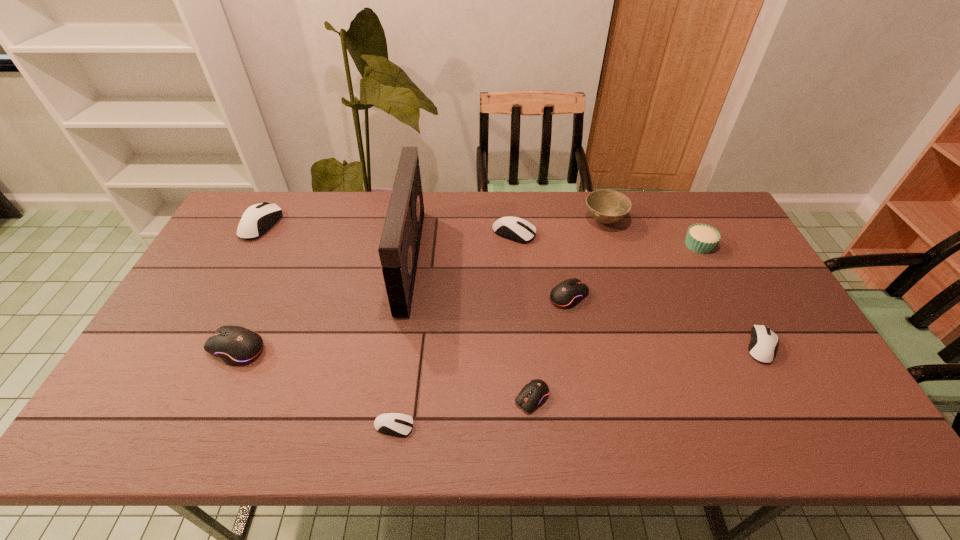
At what (x,y) coordinates should I click in order to perform the action: click on vacant space located on the front of the leftmost black computer mouse. Please return your answer as a coordinate pair (x, y). Looking at the image, I should click on (199, 431).

This screenshot has width=960, height=540. I want to click on free spot located on the left of the cupcake, so click(588, 245).

Identify the location of vacant space situated 0.220m on the right of the third smallest white mouse. (601, 233).

At what (x,y) coordinates should I click in order to perform the action: click on free location located 0.320m on the front of the second mouse from right to left. Please return your answer as a coordinate pair (x, y). The width and height of the screenshot is (960, 540). Looking at the image, I should click on (591, 416).

I want to click on vacant space located on the left of the rightmost mouse, so click(x=637, y=346).

At what (x,y) coordinates should I click in order to perform the action: click on blank space located on the back of the ninth farthest object. Please return your answer as a coordinate pair (x, y). The height and width of the screenshot is (540, 960). Looking at the image, I should click on (521, 280).

Where is `free space located 0.230m on the back of the nearest white mouse`? This screenshot has height=540, width=960. free space located 0.230m on the back of the nearest white mouse is located at coordinates (407, 335).

Where is `videotape present at the far edge`? videotape present at the far edge is located at coordinates (399, 245).

The width and height of the screenshot is (960, 540). I want to click on bowl at the far edge, so click(606, 206).

Identify the location of cupcake that is at the right edge. The height and width of the screenshot is (540, 960). (701, 238).